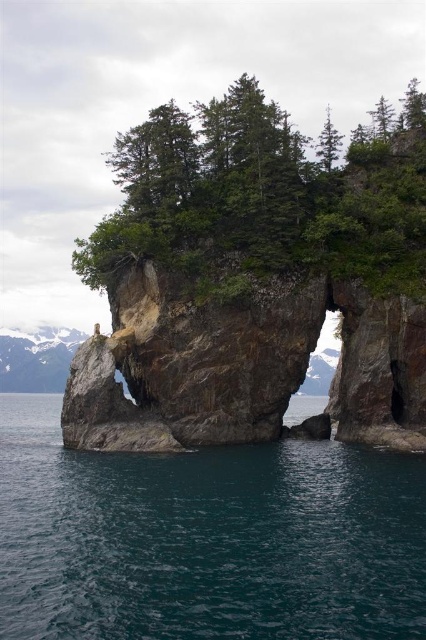
Measure the distance between green rough rock at upper center and green matte tree at upper right.

They are 28.38 meters apart.

Is green rough rock at upper center below green matte tree at upper right?

Yes.

Is point (425, 264) farther from camera compared to point (412, 109)?

That is False.

I want to click on green rough rock at upper center, so click(262, 198).

Between point (348, 296) and point (402, 120), which one is positioned behind?

The point (402, 120) is more distant.

Image resolution: width=426 pixels, height=640 pixels. I want to click on rough stone arch at center, so click(x=241, y=365).

Identify the location of rough stone arch at center. The image size is (426, 640). (241, 365).

Does green rough rock at upper center have a larger size compared to green matte tree at upper center?

Yes.

Is green rough rock at upper center above green matte tree at upper center?

Indeed, green rough rock at upper center is positioned over green matte tree at upper center.

Is point (143, 209) positioned behind point (328, 120)?

No.

The height and width of the screenshot is (640, 426). Find the location of `green rough rock at upper center`. green rough rock at upper center is located at coordinates (262, 198).